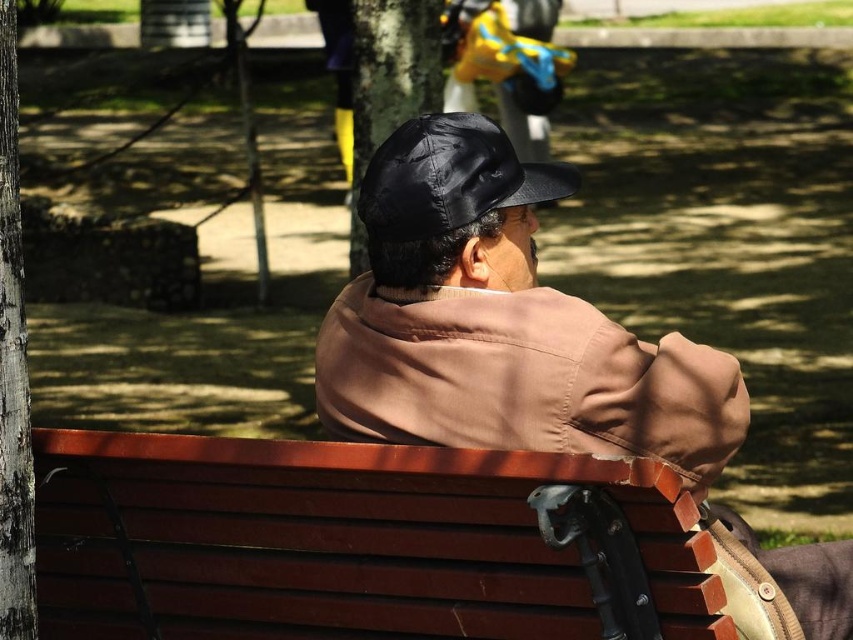
Question: Is black leather cap at center positioned before black matte tree at upper center?

Choices:
 (A) yes
 (B) no

Answer: (A)

Question: Is brown matte jacket at center above black matte tree at upper center?

Choices:
 (A) no
 (B) yes

Answer: (A)

Question: Where is wooden bench at center located in relation to brown matte jacket at center in the image?

Choices:
 (A) right
 (B) left

Answer: (B)

Question: Among these objects, which one is nearest to the camera?

Choices:
 (A) brown matte jacket at center
 (B) black matte tree at upper center
 (C) wooden bench at center
 (D) gray textured bark at left

Answer: (C)

Question: Among these objects, which one is nearest to the camera?

Choices:
 (A) brown matte jacket at center
 (B) gray textured bark at left
 (C) black matte tree at upper center

Answer: (B)

Question: Based on their relative distances, which object is nearer to the black leather cap at center?

Choices:
 (A) gray textured bark at left
 (B) brown matte jacket at center
 (C) wooden bench at center

Answer: (B)